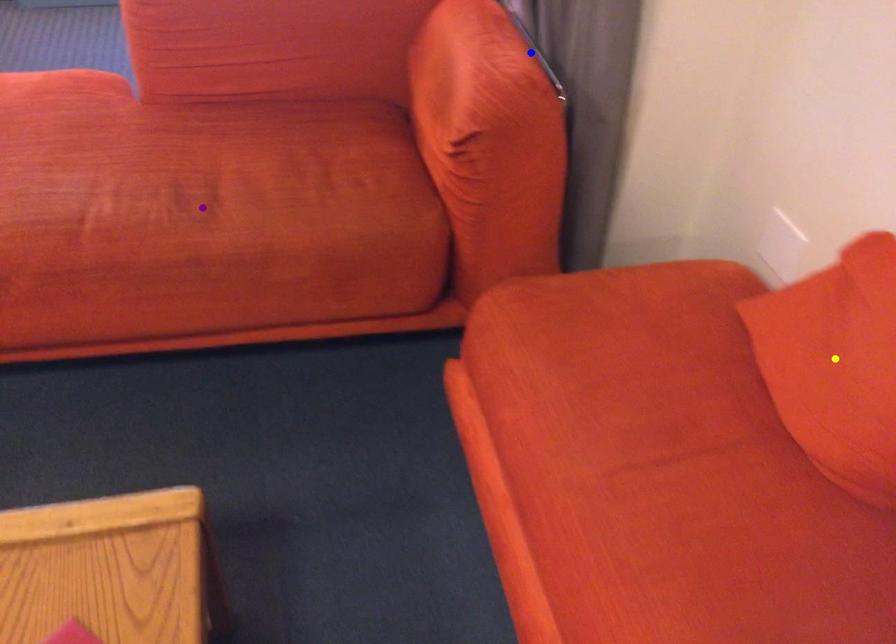
Order these from nearest to farthest:
- purple point
- yellow point
- blue point

yellow point < purple point < blue point